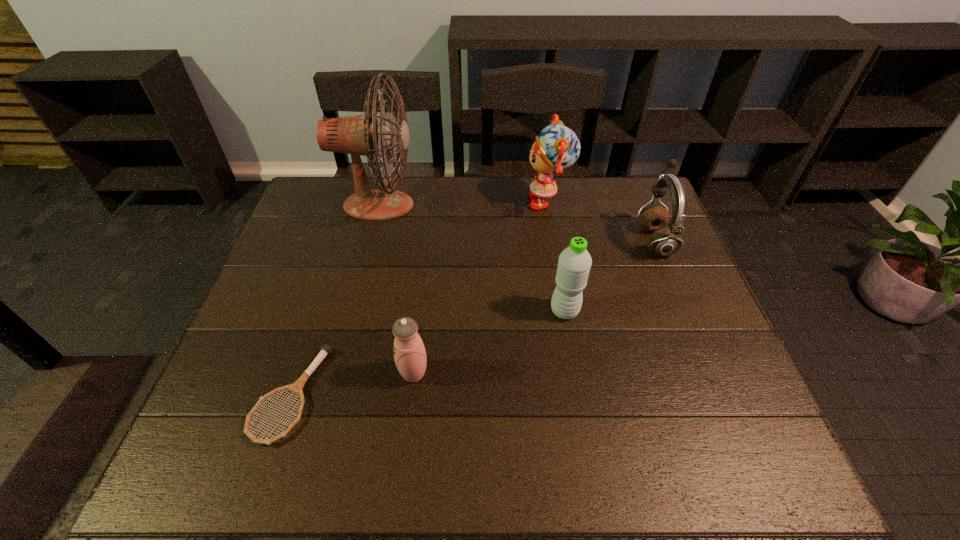
Image resolution: width=960 pixels, height=540 pixels. What are the coordinates of `fan` in the screenshot? It's located at (357, 135).

Identify the location of doll. (557, 147).

Image resolution: width=960 pixels, height=540 pixels. Identify the location of earphone. (663, 242).

Locate an element on the screen. the third nearest object is located at coordinates (574, 264).

You are a GUI agent. You are given a task and a screenshot of the screen. Output one action in this format:
    pyautogui.click(x=<x>, y=<y>)
    Task: Click on the third object from left to right
    Image resolution: width=960 pixels, height=540 pixels.
    Given the screenshot: What is the action you would take?
    pyautogui.click(x=410, y=357)

You are a GUI agent. You are given a task and a screenshot of the screen. Output one action in this format:
    pyautogui.click(x=<x>, y=<y>)
    Task: Click on the thermos bottle
    The image size is (960, 540).
    Given the screenshot: What is the action you would take?
    pyautogui.click(x=410, y=357)

You are a GUI agent. You are given a task and a screenshot of the screen. Output one action in this format:
    pyautogui.click(x=<x>, y=<y>)
    Task: Click on the shortest object
    The image size is (960, 540).
    Given the screenshot: What is the action you would take?
    pyautogui.click(x=296, y=387)

The image size is (960, 540). I want to click on free region located 0.370m in front of the tallest object to direct airflow, so click(x=534, y=205).

This screenshot has width=960, height=540. Find the location of `vacant space located on the face of the doll`. vacant space located on the face of the doll is located at coordinates (479, 202).

Locate an element on the screen. vacant space located on the face of the doll is located at coordinates (x=432, y=202).